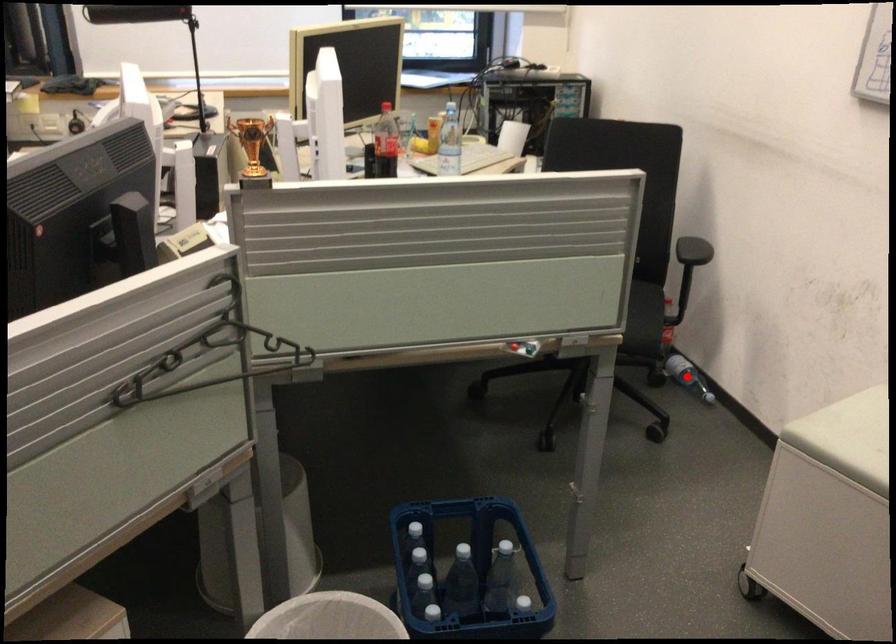
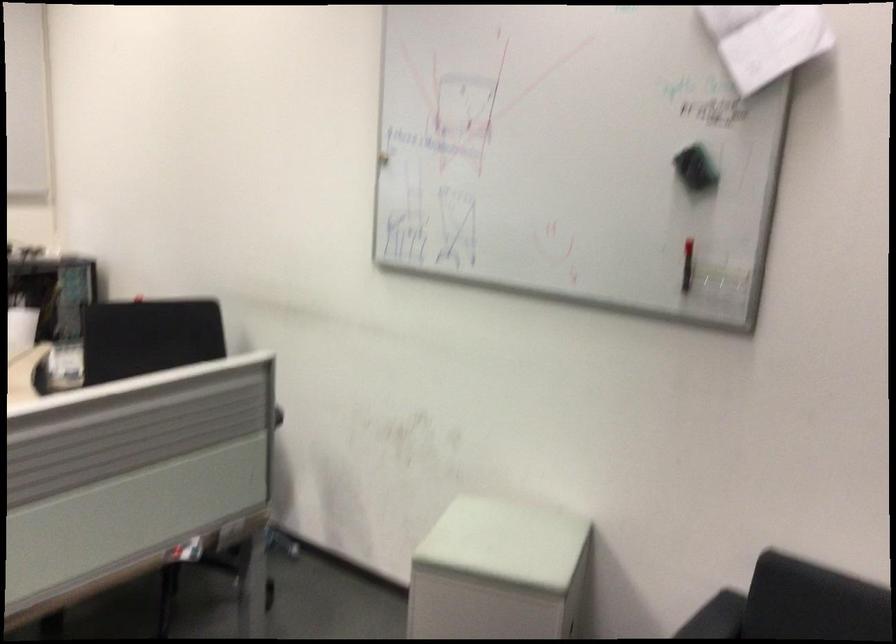
Question: I am providing you with two images of the same scene from different viewpoints. A red point is shown in image1. For the corresponding object point in image2, is it positioned nearer or farther from the camera?

Choices:
 (A) Nearer
 (B) Farther

Answer: (A)